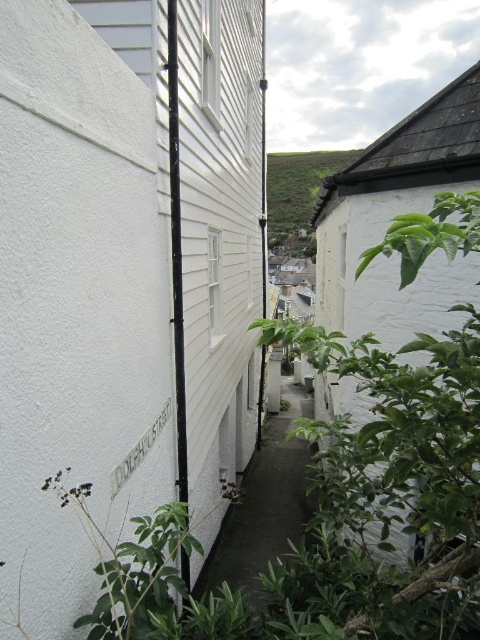
Between point (168, 563) and point (307, 205), which one is positioned behind?

The point (307, 205) is more distant.

Measure the distance between green leafy plant at lower center and camera.

They are 2.08 meters apart.

At what (x,y) coordinates should I click in order to perform the action: click on green leafy plant at lower center. Please return your answer as a coordinate pair (x, y). Image resolution: width=480 pixels, height=640 pixels. Looking at the image, I should click on (133, 566).

Looking at this image, is the position of dark gray concrete alley at center less distant than that of green leafy plant at lower center?

No, dark gray concrete alley at center is further to the viewer.

Does point (279, 448) lie in front of point (232, 497)?

No, (279, 448) is behind (232, 497).

Who is more forward, (202, 579) or (99, 595)?

Point (99, 595) is more forward.

Where is `dark gray concrete alley at center`? This screenshot has width=480, height=640. dark gray concrete alley at center is located at coordinates (264, 504).

Who is more distant from viewer, (290, 417) or (297, 221)?

Positioned behind is point (297, 221).

Where is `dark gray concrete alley at center`? dark gray concrete alley at center is located at coordinates coord(264,504).

Describe the element at coordinates (264, 504) in the screenshot. I see `dark gray concrete alley at center` at that location.

This screenshot has width=480, height=640. In order to click on dark gray concrete alley at center in this screenshot , I will do `click(264, 504)`.